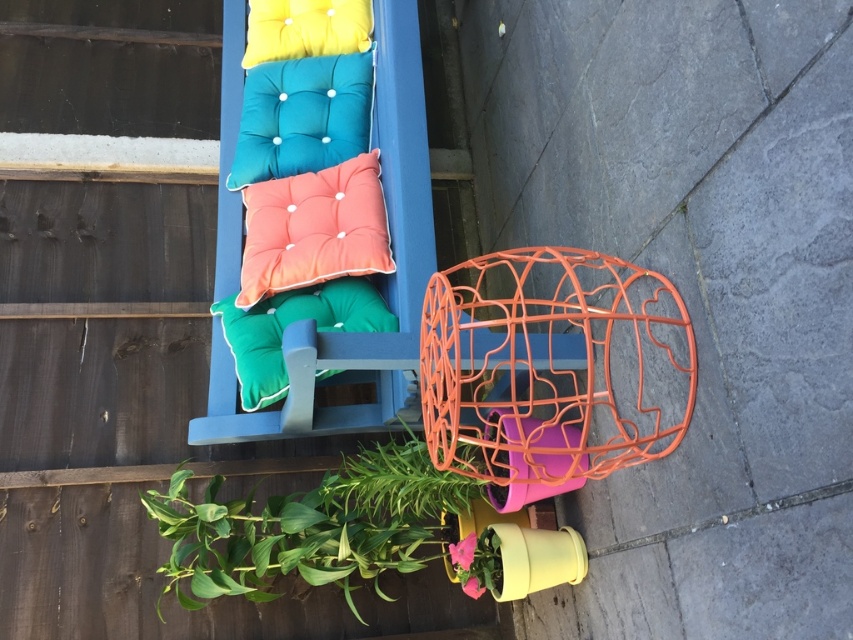
From the picture: Can you confirm if green leafy plant at lower left is wider than green fabric pillow at center?

Yes.

Does green leafy plant at lower left appear on the right side of green fabric pillow at center?

Indeed, green leafy plant at lower left is positioned on the right side of green fabric pillow at center.

Describe the element at coordinates (311, 528) in the screenshot. I see `green leafy plant at lower left` at that location.

Find the location of `green leafy plant at lower left`. green leafy plant at lower left is located at coordinates (311, 528).

Is coral fabric cushion at center taller than green fabric pillow at center?

Yes.

Does coral fabric cushion at center appear on the left side of green fabric pillow at center?

In fact, coral fabric cushion at center is to the right of green fabric pillow at center.

Describe the element at coordinates (314, 228) in the screenshot. Image resolution: width=853 pixels, height=640 pixels. I see `coral fabric cushion at center` at that location.

The width and height of the screenshot is (853, 640). I want to click on coral fabric cushion at center, so click(314, 228).

Looking at this image, between green leafy plant at lower left and coral fabric cushion at center, which one appears on the left side from the viewer's perspective?

From the viewer's perspective, coral fabric cushion at center appears more on the left side.

Who is more distant from viewer, (404,509) or (368,156)?

The point (368,156) is more distant.

The width and height of the screenshot is (853, 640). I want to click on green leafy plant at lower left, so click(311, 528).